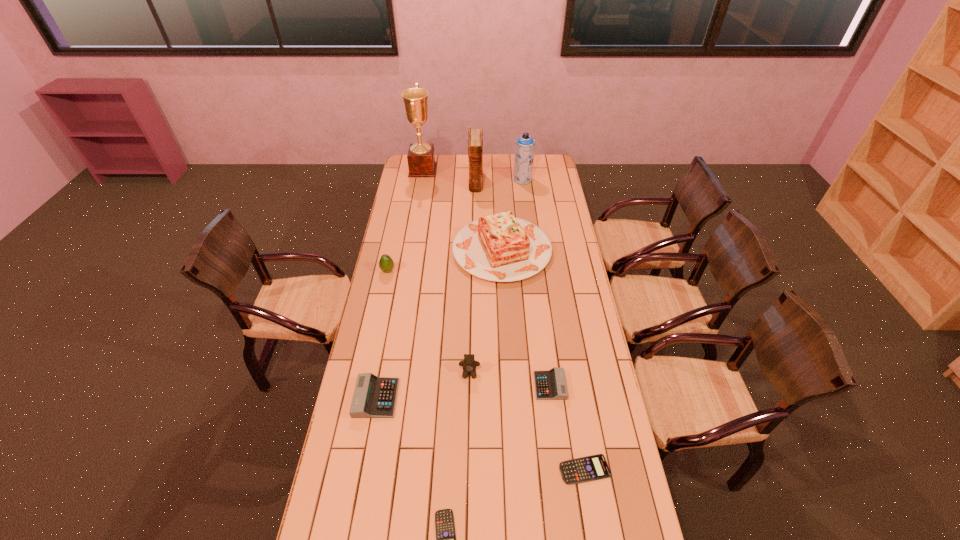
Where is `blank area in the image that satisfies the following two spatial constraints: 1. on the spine side of the hardback book; 2. on the left side of the smaller gray calculator`? The width and height of the screenshot is (960, 540). blank area in the image that satisfies the following two spatial constraints: 1. on the spine side of the hardback book; 2. on the left side of the smaller gray calculator is located at coordinates (473, 386).